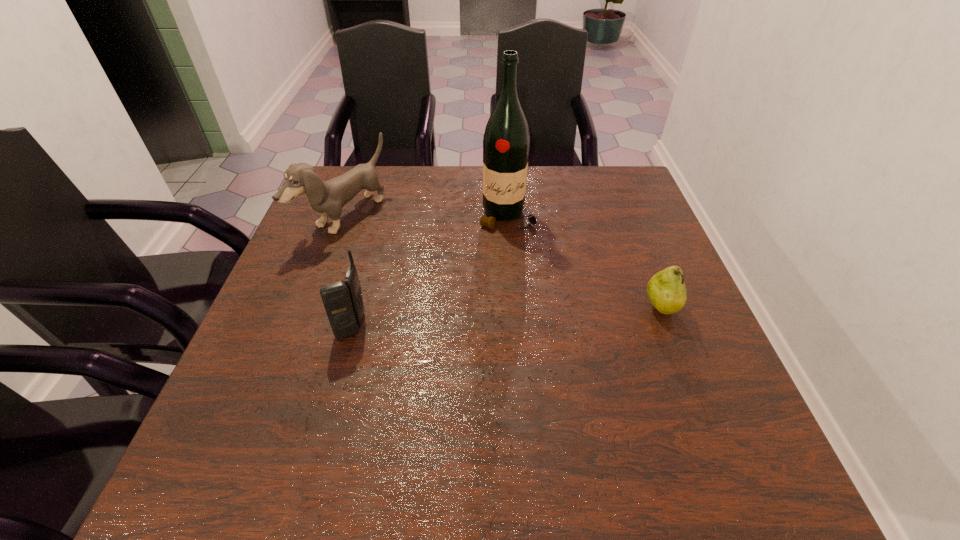
Locate an element on the screen. This screenshot has height=540, width=960. object at the far left corner is located at coordinates (327, 198).

Identify the location of blank space at the far edge of the desktop. The height and width of the screenshot is (540, 960). (410, 200).

Identify the location of vacant space at the near edge of the desktop. Image resolution: width=960 pixels, height=540 pixels. (415, 402).

In the image, there is a desktop. Identify the location of vacant area at the left edge. (332, 246).

The height and width of the screenshot is (540, 960). In order to click on vacant space at the right edge of the desktop in this screenshot , I will do `click(662, 327)`.

Image resolution: width=960 pixels, height=540 pixels. I want to click on vacant region at the far right corner of the desktop, so click(616, 180).

You are a GUI agent. You are given a task and a screenshot of the screen. Output one action in this format:
    pyautogui.click(x=<x>, y=<y>)
    Task: Click on the free space between the third object from left to right and the cellular telephone
    Image resolution: width=960 pixels, height=540 pixels.
    Given the screenshot: What is the action you would take?
    pyautogui.click(x=429, y=271)

Where is `free point between the rightmost object and the second object from right to left`? The height and width of the screenshot is (540, 960). free point between the rightmost object and the second object from right to left is located at coordinates (584, 262).

Find the location of a particular element. unoccupied area between the tallest object and the cellular telephone is located at coordinates (429, 271).

The width and height of the screenshot is (960, 540). Identify the location of vacant point located between the cellular telephone and the tallest object. (429, 271).